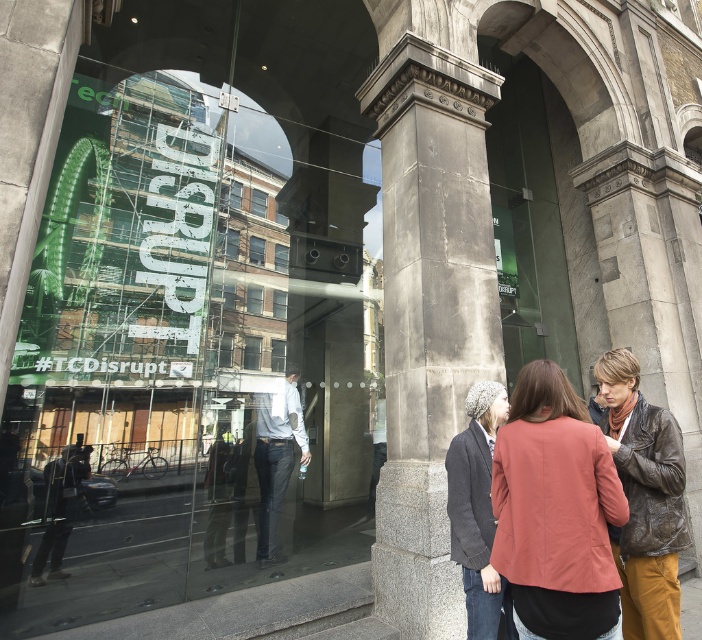
Question: Among these objects, which one is nearest to the camera?

Choices:
 (A) gray woolen beanie at center
 (B) transparent glass window at center
 (C) light blue denim jeans at center
 (D) leather jacket at center

Answer: (D)

Question: Which of these objects is positioned closest to the brown leather jacket at right?

Choices:
 (A) leather jacket at center
 (B) gray stone column at center
 (C) light blue denim jeans at center

Answer: (A)

Question: Can you confirm if leather jacket at center is positioned to the right of brown leather jacket at right?

Choices:
 (A) no
 (B) yes

Answer: (A)

Question: Is leather jacket at center to the right of brown leather jacket at right from the viewer's perspective?

Choices:
 (A) yes
 (B) no

Answer: (B)

Question: Observing the image, what is the correct spatial positioning of gray stone column at center in reference to light blue denim jeans at center?

Choices:
 (A) above
 (B) below

Answer: (A)

Question: Which object is the farthest from the gray stone column at center?

Choices:
 (A) leather jacket at center
 (B) transparent glass window at center
 (C) brown leather jacket at right

Answer: (B)